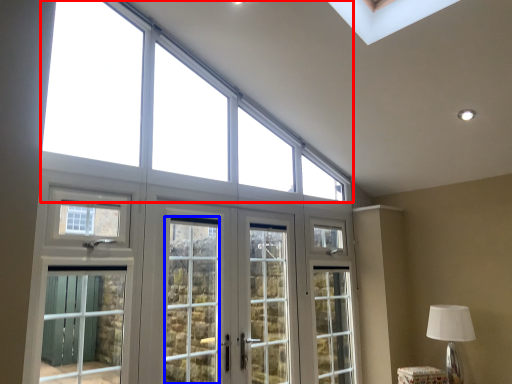
Question: Which of the following is the closest to the observer, window (highlighted by a red box) or screen door (highlighted by a blue box)?

Choices:
 (A) window
 (B) screen door

Answer: (A)